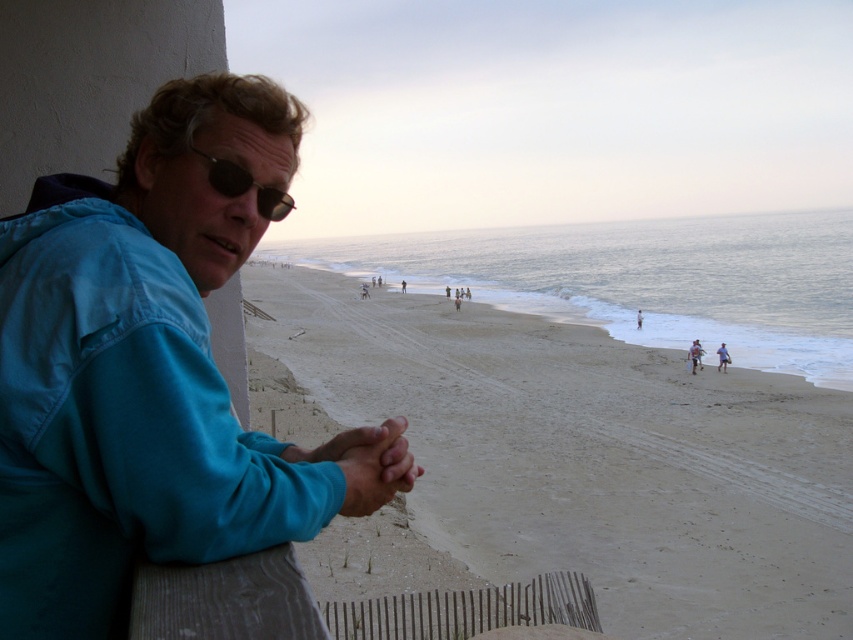
Question: Does smooth sand beach at center appear under blue fabric jacket at left?

Choices:
 (A) no
 (B) yes

Answer: (B)

Question: Which of the following is the farthest from the observer?

Choices:
 (A) (741, 396)
 (B) (212, 157)
 (C) (235, 419)

Answer: (A)

Question: Which point is farther to the camera?

Choices:
 (A) (791, 532)
 (B) (216, 170)

Answer: (A)

Question: Which of these objects is positioned closest to the black reflective sunglasses at upper left?

Choices:
 (A) smooth sand beach at center
 (B) blue fabric jacket at left

Answer: (B)

Question: Is blue fabric jacket at left smaller than black reflective sunglasses at upper left?

Choices:
 (A) yes
 (B) no

Answer: (B)

Question: Observing the image, what is the correct spatial positioning of smooth sand beach at center in reference to black reflective sunglasses at upper left?

Choices:
 (A) above
 (B) below

Answer: (B)